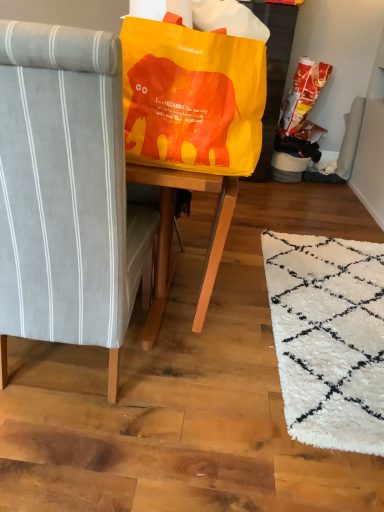
In order to click on matte yellow bean bag chair at upper center in this screenshot , I will do `click(192, 98)`.

Does gray fabric chair at left turn towards matte orange plastic bag at upper right?

No, gray fabric chair at left is not facing towards matte orange plastic bag at upper right.

From a real-world perspective, is gray fabric chair at left located higher than matte orange plastic bag at upper right?

No, from a real-world perspective, gray fabric chair at left is not above matte orange plastic bag at upper right.

Who is taller, gray fabric chair at left or matte orange plastic bag at upper right?

With more height is gray fabric chair at left.

Considering the sizes of objects matte yellow bean bag chair at upper center and matte orange plastic bag at upper right in the image provided, who is shorter, matte yellow bean bag chair at upper center or matte orange plastic bag at upper right?

With less height is matte yellow bean bag chair at upper center.

Does matte yellow bean bag chair at upper center appear on the right side of matte orange plastic bag at upper right?

Incorrect, matte yellow bean bag chair at upper center is not on the right side of matte orange plastic bag at upper right.

Could you measure the distance between matte yellow bean bag chair at upper center and matte orange plastic bag at upper right?

matte yellow bean bag chair at upper center is 2.50 meters away from matte orange plastic bag at upper right.

Which object is more forward, matte yellow bean bag chair at upper center or matte orange plastic bag at upper right?

Positioned in front is matte yellow bean bag chair at upper center.

In terms of width, does matte orange plastic bag at upper right look wider or thinner when compared to matte yellow bean bag chair at upper center?

Considering their sizes, matte orange plastic bag at upper right looks slimmer than matte yellow bean bag chair at upper center.

Considering the relative positions of matte orange plastic bag at upper right and matte yellow bean bag chair at upper center in the image provided, is matte orange plastic bag at upper right to the left or to the right of matte yellow bean bag chair at upper center?

Clearly, matte orange plastic bag at upper right is on the right of matte yellow bean bag chair at upper center in the image.

From a real-world perspective, which is physically below, matte orange plastic bag at upper right or matte yellow bean bag chair at upper center?

In real-world perspective, matte orange plastic bag at upper right is lower.

You are a GUI agent. You are given a task and a screenshot of the screen. Output one action in this format:
    pyautogui.click(x=<x>, y=<y>)
    Task: Click on the grocery bag on the right of matte yellow bean bag chair at upper center
    This screenshot has width=384, height=512.
    Given the screenshot: What is the action you would take?
    pyautogui.click(x=302, y=94)

How far apart are matte orange plastic bag at upper right and gray fabric chair at left?

They are 8.61 feet apart.

Where is `grocery bag that appears on the right of gray fabric chair at left`? This screenshot has height=512, width=384. grocery bag that appears on the right of gray fabric chair at left is located at coordinates (302, 94).

From a real-world perspective, is matte orange plastic bag at upper right physically above gray fabric chair at left?

Indeed, from a real-world perspective, matte orange plastic bag at upper right stands above gray fabric chair at left.

Considering the relative sizes of matte orange plastic bag at upper right and gray fabric chair at left in the image provided, is matte orange plastic bag at upper right shorter than gray fabric chair at left?

Indeed, matte orange plastic bag at upper right has a lesser height compared to gray fabric chair at left.

From the picture: Does matte yellow bean bag chair at upper center turn towards gray fabric chair at left?

Yes.

Between matte yellow bean bag chair at upper center and gray fabric chair at left, which one has larger width?

Wider between the two is gray fabric chair at left.

Would you say matte yellow bean bag chair at upper center is outside gray fabric chair at left?

Actually, matte yellow bean bag chair at upper center is at least partially inside gray fabric chair at left.

How far apart are matte yellow bean bag chair at upper center and gray fabric chair at left?

matte yellow bean bag chair at upper center and gray fabric chair at left are 27.91 centimeters apart.

Is gray fabric chair at left facing away from matte yellow bean bag chair at upper center?

gray fabric chair at left does not have its back to matte yellow bean bag chair at upper center.

Considering the sizes of objects gray fabric chair at left and matte yellow bean bag chair at upper center in the image provided, who is bigger, gray fabric chair at left or matte yellow bean bag chair at upper center?

Bigger between the two is gray fabric chair at left.

Considering the positions of point (77, 311) and point (156, 141), is point (77, 311) closer or farther from the camera than point (156, 141)?

Point (77, 311).

Do you think gray fabric chair at left is within matte yellow bean bag chair at upper center, or outside of it?

gray fabric chair at left is outside matte yellow bean bag chair at upper center.

This screenshot has height=512, width=384. In order to click on chair on the left of the matte orange plastic bag at upper right in this screenshot , I will do [x=67, y=193].

I want to click on grocery bag behind the matte yellow bean bag chair at upper center, so click(302, 94).

Considering their positions, is gray fabric chair at left positioned closer to matte orange plastic bag at upper right than matte yellow bean bag chair at upper center?

matte yellow bean bag chair at upper center lies closer to matte orange plastic bag at upper right than the other object.

Which object lies further to the anchor point gray fabric chair at left, matte orange plastic bag at upper right or matte yellow bean bag chair at upper center?

The object further to gray fabric chair at left is matte orange plastic bag at upper right.

Based on their spatial positions, is matte yellow bean bag chair at upper center or gray fabric chair at left further from matte orange plastic bag at upper right?

gray fabric chair at left lies further to matte orange plastic bag at upper right than the other object.

From the image, which object appears to be nearer to gray fabric chair at left, matte yellow bean bag chair at upper center or matte orange plastic bag at upper right?

matte yellow bean bag chair at upper center is closer to gray fabric chair at left.

Which object lies further to the anchor point matte yellow bean bag chair at upper center, gray fabric chair at left or matte orange plastic bag at upper right?

Based on the image, matte orange plastic bag at upper right appears to be further to matte yellow bean bag chair at upper center.

Considering their positions, is matte orange plastic bag at upper right positioned closer to matte yellow bean bag chair at upper center than gray fabric chair at left?

gray fabric chair at left.

Identify the location of bean bag chair between gray fabric chair at left and matte orange plastic bag at upper right from front to back. This screenshot has width=384, height=512. (192, 98).